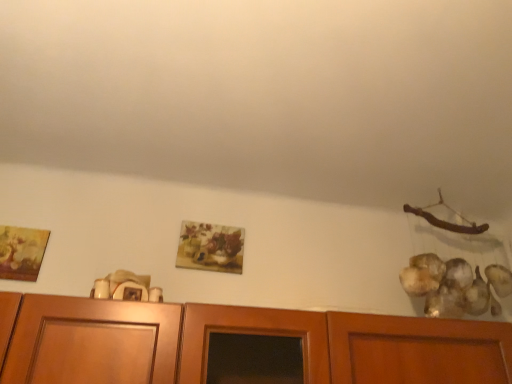
Question: Considering the positions of matte floral print at center, the 2th picture frame positioned from the left, and matte gold picture frame at left, which appears as the 1th picture frame when viewed from the front, in the image, is matte floral print at center, the 2th picture frame positioned from the left, taller or shorter than matte gold picture frame at left, which appears as the 1th picture frame when viewed from the front,?

Choices:
 (A) short
 (B) tall

Answer: (B)

Question: From the image's perspective, is matte floral print at center, which is the second picture frame in front-to-back order, located above or below matte gold picture frame at left, which is counted as the second picture frame, starting from the right?

Choices:
 (A) below
 (B) above

Answer: (A)

Question: Is matte floral print at center, which is the second picture frame in front-to-back order, inside or outside of matte gold picture frame at left, placed as the 2th picture frame when sorted from back to front?

Choices:
 (A) inside
 (B) outside

Answer: (B)

Question: From the image's perspective, relative to matte floral print at center, placed as the 1th picture frame when sorted from back to front, is matte gold picture frame at left, placed as the 2th picture frame when sorted from back to front, above or below?

Choices:
 (A) below
 (B) above

Answer: (B)

Question: Considering their positions, is matte gold picture frame at left, placed as the 2th picture frame when sorted from back to front, located in front of or behind matte floral print at center, which is counted as the 1th picture frame, starting from the right?

Choices:
 (A) behind
 (B) front

Answer: (B)

Question: In terms of width, does matte gold picture frame at left, which appears as the 1th picture frame when viewed from the front, look wider or thinner when compared to matte floral print at center, which is counted as the 1th picture frame, starting from the right?

Choices:
 (A) thin
 (B) wide

Answer: (B)

Question: Looking at the image, does matte gold picture frame at left, placed as the 2th picture frame when sorted from back to front, seem bigger or smaller compared to matte floral print at center, which is counted as the 1th picture frame, starting from the right?

Choices:
 (A) small
 (B) big

Answer: (B)